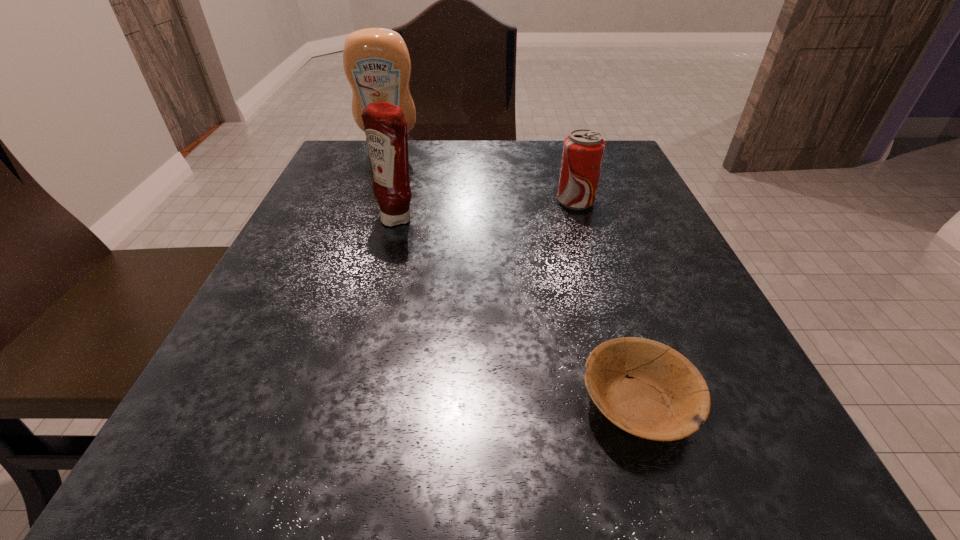
Where is `the farthest object`? the farthest object is located at coordinates (376, 61).

Image resolution: width=960 pixels, height=540 pixels. What are the coordinates of `the taller condiment` in the screenshot? It's located at (376, 61).

You are a GUI agent. You are given a task and a screenshot of the screen. Output one action in this format:
    pyautogui.click(x=<x>, y=<y>)
    Task: Click on the shorter condiment
    
    Given the screenshot: What is the action you would take?
    pyautogui.click(x=385, y=126)

Where is `the nearer condiment`? This screenshot has height=540, width=960. the nearer condiment is located at coordinates (385, 126).

The width and height of the screenshot is (960, 540). What are the coordinates of `soda can` in the screenshot? It's located at (583, 151).

This screenshot has width=960, height=540. I want to click on bowl, so click(664, 397).

Locate an element on the screen. The width and height of the screenshot is (960, 540). the nearest object is located at coordinates (664, 397).

This screenshot has width=960, height=540. I want to click on vacant space located on the label of the taller condiment, so click(363, 224).

The width and height of the screenshot is (960, 540). What are the coordinates of `free space located 0.050m on the front of the nearer condiment` in the screenshot? It's located at (391, 247).

Locate an element on the screen. This screenshot has width=960, height=540. vacant space located 0.370m on the left of the soda can is located at coordinates (375, 202).